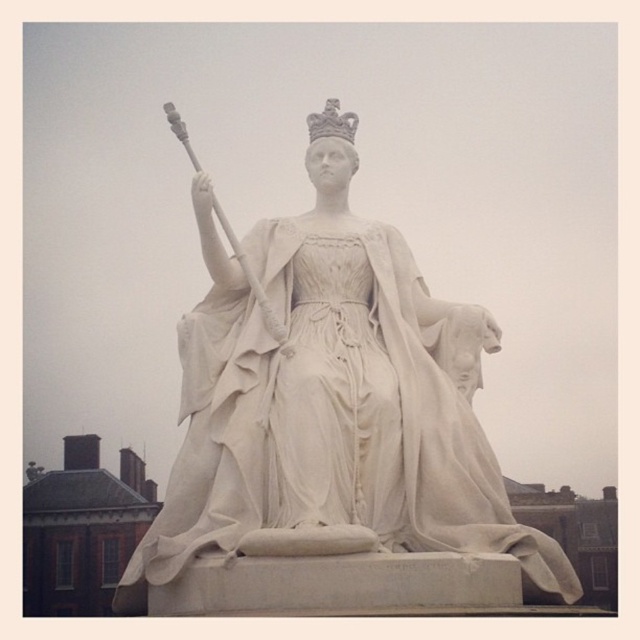
Question: Which point is closer to the camera?

Choices:
 (A) (353, 120)
 (B) (392, 298)

Answer: (B)

Question: From the image, what is the correct spatial relationship of white marble statue at center in relation to white stone crown at upper center?

Choices:
 (A) left
 (B) right

Answer: (B)

Question: Does white marble statue at center appear on the left side of white stone crown at upper center?

Choices:
 (A) yes
 (B) no

Answer: (B)

Question: Which point is closer to the camera?

Choices:
 (A) (326, 132)
 (B) (136, 611)

Answer: (B)

Question: Does white marble statue at center appear on the right side of white stone crown at upper center?

Choices:
 (A) no
 (B) yes

Answer: (B)